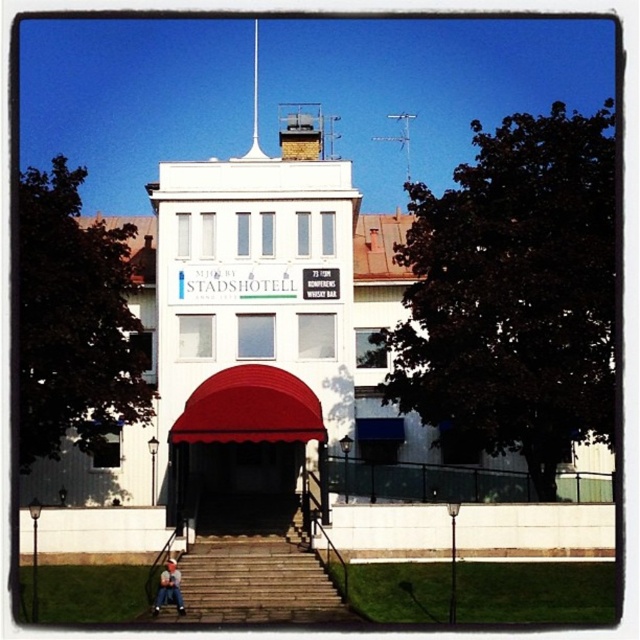
Question: Does stone stairs at center have a larger size compared to red fabric awning at center?

Choices:
 (A) no
 (B) yes

Answer: (A)

Question: Which object is positioned farthest from the stone stairs at center?

Choices:
 (A) red fabric awning at center
 (B) blue denim jeans at lower center

Answer: (A)

Question: Which of the following is the farthest from the observer?

Choices:
 (A) blue denim jeans at lower center
 (B) stone stairs at center
 (C) red fabric awning at center

Answer: (C)

Question: Which of the following is the farthest from the observer?

Choices:
 (A) red fabric awning at center
 (B) blue denim jeans at lower center
 (C) stone stairs at center

Answer: (A)

Question: Where is red fabric awning at center located in relation to blue denim jeans at lower center in the image?

Choices:
 (A) above
 (B) below

Answer: (A)

Question: Is stone stairs at center to the right of blue denim jeans at lower center from the viewer's perspective?

Choices:
 (A) yes
 (B) no

Answer: (A)